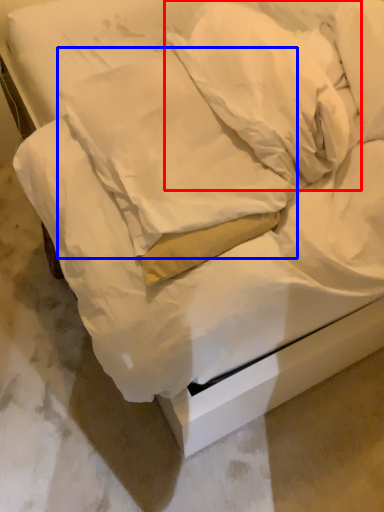
Question: Which of the following is the farthest to the observer, pillow (highlighted by a red box) or pillow (highlighted by a blue box)?

Choices:
 (A) pillow
 (B) pillow

Answer: (A)